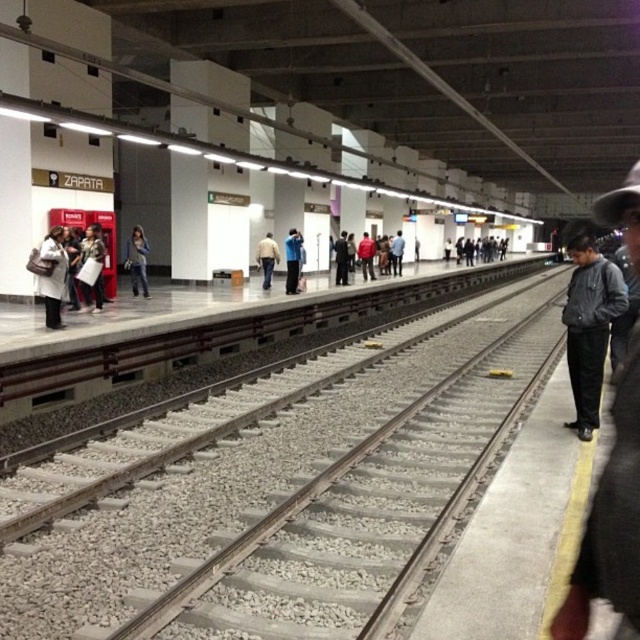
Can you confirm if white fabric coat at left is wider than denim pants at center?

Correct, the width of white fabric coat at left exceeds that of denim pants at center.

Is the position of white fabric coat at left less distant than that of denim pants at center?

Yes, white fabric coat at left is in front of denim pants at center.

Is point (60, 240) farther from viewer compared to point (136, 234)?

No, (60, 240) is closer to viewer.

Where is `white fabric coat at left`? This screenshot has width=640, height=640. white fabric coat at left is located at coordinates (52, 275).

Between point (272, 248) and point (486, 250), which one is positioned behind?

The point (486, 250) is more distant.

Does dark blue jeans at center have a lesser width compared to dark blue jacket at center?

Yes, dark blue jeans at center is thinner than dark blue jacket at center.

Which is in front, point (266, 240) or point (483, 246)?

Point (266, 240) is in front.

Find the location of a particular element. dark blue jeans at center is located at coordinates (268, 259).

Consider the image. Can you confirm if white fabric coat at left is positioned below dark blue jacket at center?

Indeed, white fabric coat at left is positioned under dark blue jacket at center.

Who is more distant from viewer, [56,253] or [483,246]?

Point [483,246]

Where is `white fabric coat at left`? The image size is (640, 640). white fabric coat at left is located at coordinates (52, 275).